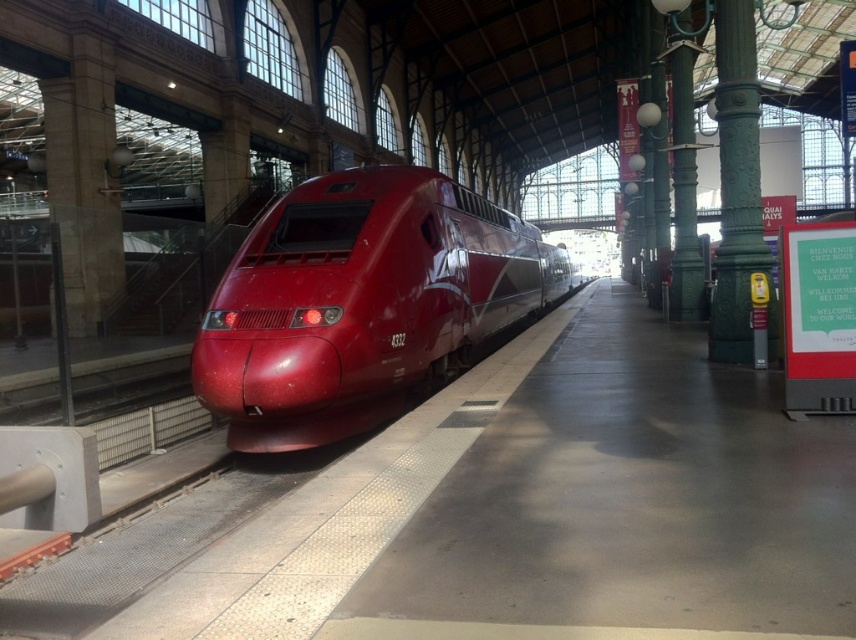
What do you see at coordinates (361, 301) in the screenshot?
I see `glossy red bullet train at center` at bounding box center [361, 301].

Does glossy red bullet train at center appear over green polished metal pillar at right?

→ Yes, glossy red bullet train at center is above green polished metal pillar at right.

Locate an element on the screen. glossy red bullet train at center is located at coordinates click(x=361, y=301).